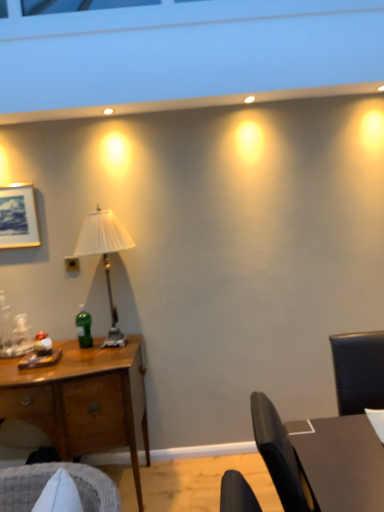
You are a GUI agent. You are given a task and a screenshot of the screen. Output one action in this format:
    pyautogui.click(x=<x>, y=<y>)
    Task: Click on the free space in front of white pleated fabric lampshade at left
    This screenshot has width=384, height=512.
    Given the screenshot: What is the action you would take?
    pyautogui.click(x=89, y=366)